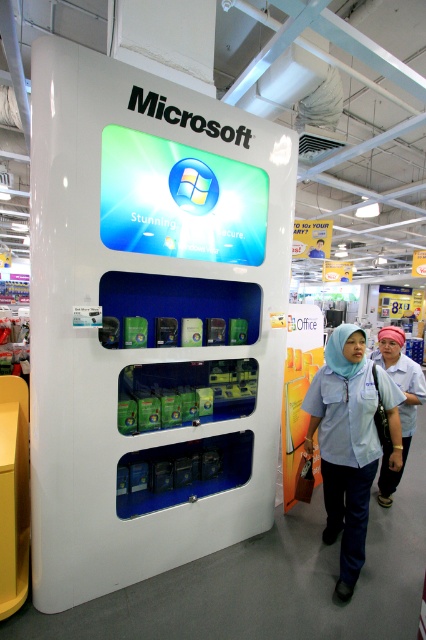
Question: Among these points, which one is nearest to the camera?

Choices:
 (A) (388, 460)
 (B) (337, 401)

Answer: (B)

Question: In this image, where is light blue fabric shirt at center located relative to white fabric hijab at center?

Choices:
 (A) right
 (B) left

Answer: (B)

Question: Does white plastic vending machine at center come behind light blue fabric shirt at center?

Choices:
 (A) no
 (B) yes

Answer: (A)

Question: Which object is closer to the camera taking this photo?

Choices:
 (A) light blue fabric shirt at center
 (B) white plastic vending machine at center
 (C) white fabric hijab at center

Answer: (B)

Question: Which of these objects is positioned closest to the white fabric hijab at center?

Choices:
 (A) white plastic vending machine at center
 (B) light blue fabric shirt at center

Answer: (B)

Question: Does white plastic vending machine at center lie in front of white fabric hijab at center?

Choices:
 (A) no
 (B) yes

Answer: (B)